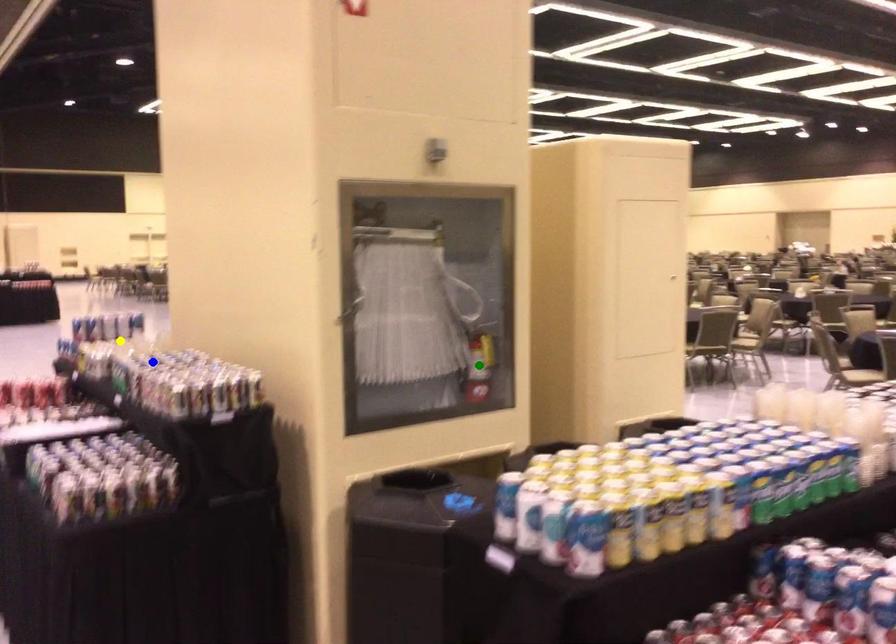
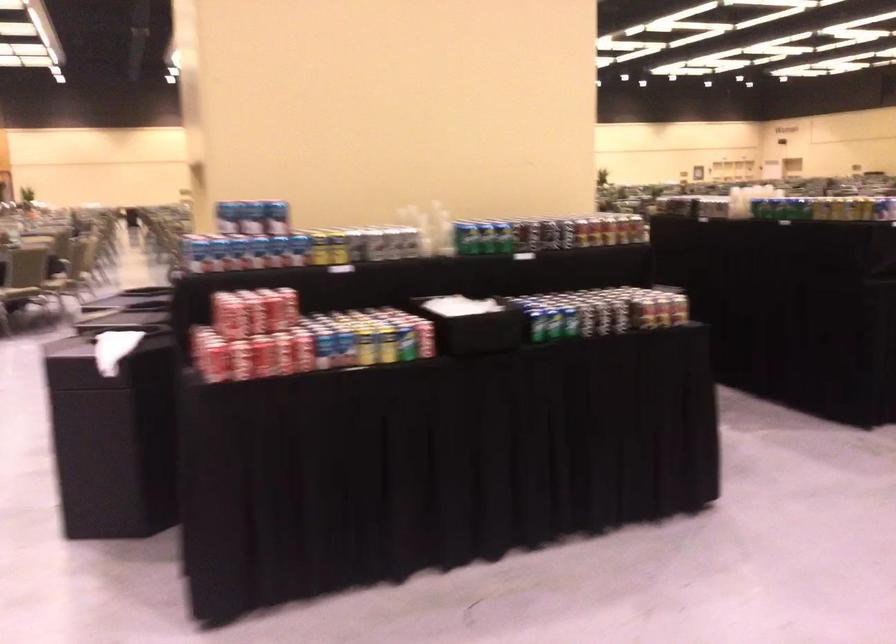
I am providing you with two images of the same scene from different viewpoints. Three points are marked in image1. Which point corresponds to a part or object that is occluded in image2?In image1, three points are marked. Which of them correspond to a part or object that is occluded in image2?Among the three points shown in image1, which one corresponds to a part or object that is no longer visible due to occlusion in image2?

green point cannot be seen in image2.